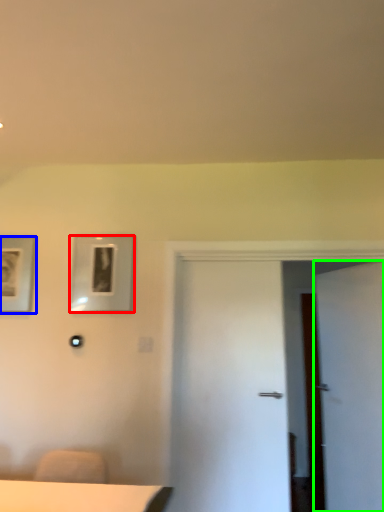
Question: Based on their relative distances, which object is nearer to picture frame (highlighted by a red box)? Choose from picture frame (highlighted by a blue box) and door (highlighted by a green box).

Choices:
 (A) picture frame
 (B) door

Answer: (A)